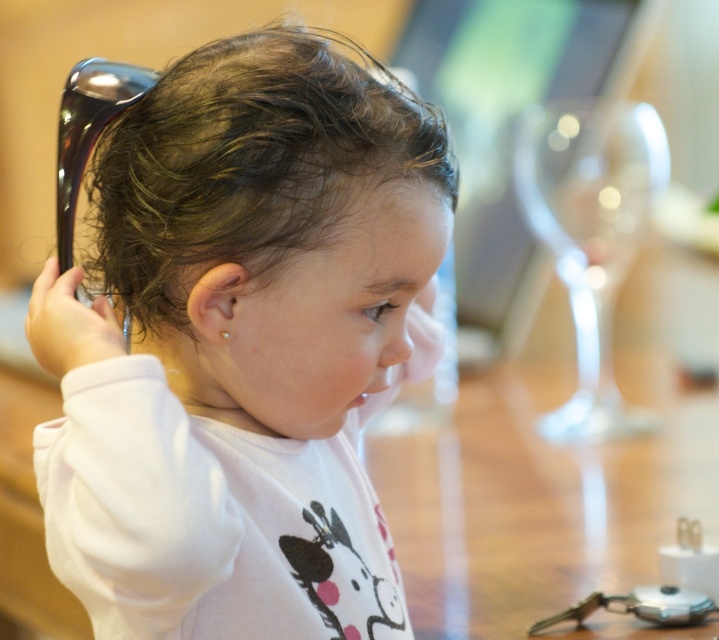
Based on the scene description, is the white matte toddler at center wider than the dark brown curly hair at center?

The white matte toddler at center might be wider than dark brown curly hair at center according to the description.